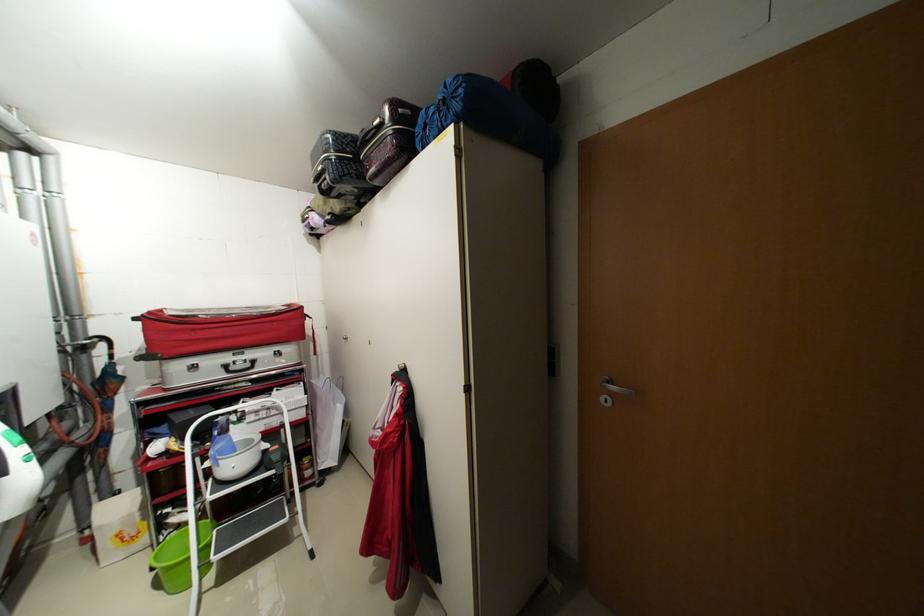
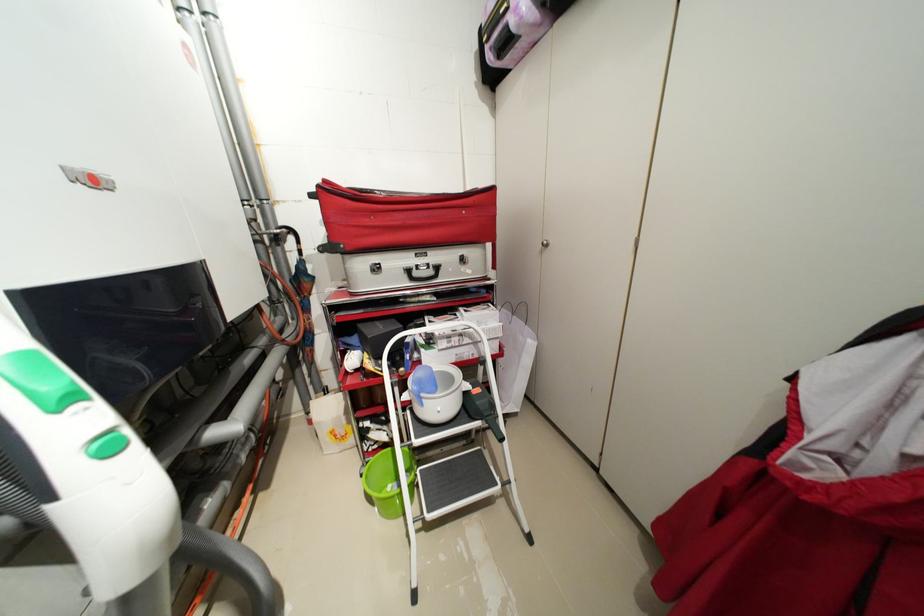
Locate, in the second image, the point that corresponds to point 157,314 in the first image.

(332, 182)